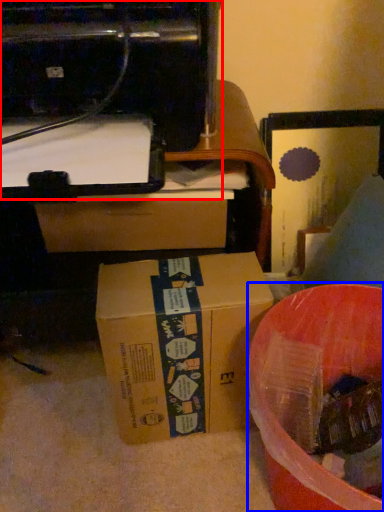
Question: Which of the following is the farthest to the observer, printer (highlighted by a red box) or waste (highlighted by a blue box)?

Choices:
 (A) printer
 (B) waste

Answer: (B)